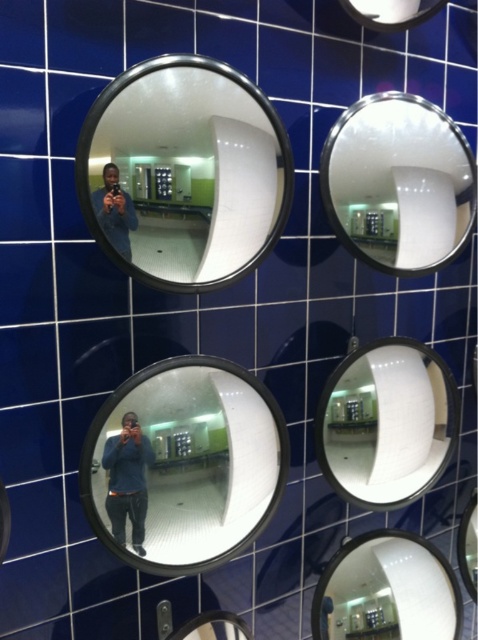
Which of these two, silver reflective mirror at upper left or shiny silver mirror at bottom right, stands taller?

Standing taller between the two is silver reflective mirror at upper left.

Which is below, silver reflective mirror at upper left or shiny silver mirror at bottom right?

shiny silver mirror at bottom right is lower down.

Identify the location of silver reflective mirror at upper left. This screenshot has height=640, width=478. (184, 172).

Identify the location of silver reflective mirror at upper left. The height and width of the screenshot is (640, 478). (184, 172).

This screenshot has width=478, height=640. What do you see at coordinates (387, 589) in the screenshot?
I see `shiny silver mirror at bottom right` at bounding box center [387, 589].

Is shiny silver mirror at bottom right positioned at the back of metallic silver mirror at lower center?

Yes.

Is point (352, 634) positioned before point (202, 621)?

No, (352, 634) is behind (202, 621).

Where is `shiny silver mirror at bottom right`? The image size is (478, 640). shiny silver mirror at bottom right is located at coordinates (387, 589).

Does silver reflective mirror at upper left appear over matte black camera at center?

Yes.

Which is more to the left, silver reflective mirror at upper left or matte black camera at center?

matte black camera at center is more to the left.

Locate an element on the screen. silver reflective mirror at upper left is located at coordinates (184, 172).